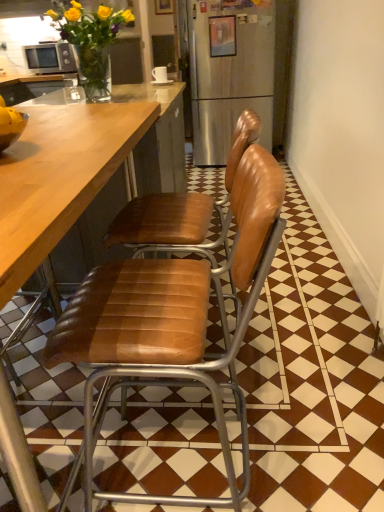
Question: Does white ceramic mug at upper center appear on the right side of translucent glass vase at upper left?

Choices:
 (A) no
 (B) yes

Answer: (B)

Question: From a real-world perspective, is white ceramic mug at upper center below translucent glass vase at upper left?

Choices:
 (A) yes
 (B) no

Answer: (A)

Question: Considering the relative sizes of white ceramic mug at upper center and translucent glass vase at upper left in the image provided, is white ceramic mug at upper center bigger than translucent glass vase at upper left?

Choices:
 (A) yes
 (B) no

Answer: (B)

Question: From the image's perspective, would you say white ceramic mug at upper center is shown under translucent glass vase at upper left?

Choices:
 (A) no
 (B) yes

Answer: (A)

Question: Is white ceramic mug at upper center further to the viewer compared to translucent glass vase at upper left?

Choices:
 (A) yes
 (B) no

Answer: (A)

Question: Are white ceramic mug at upper center and translucent glass vase at upper left located far from each other?

Choices:
 (A) yes
 (B) no

Answer: (B)

Question: Considering the relative positions of wooden picture frame at upper center, positioned as the 2th picture frame in top-to-bottom order, and leather at center, the second chair positioned from the back, in the image provided, is wooden picture frame at upper center, positioned as the 2th picture frame in top-to-bottom order, behind leather at center, the second chair positioned from the back,?

Choices:
 (A) yes
 (B) no

Answer: (A)

Question: From the image's perspective, is wooden picture frame at upper center, the 1th picture frame in the front-to-back sequence, above leather at center, the second chair positioned from the back?

Choices:
 (A) no
 (B) yes

Answer: (B)

Question: Is wooden picture frame at upper center, the 1th picture frame in the right-to-left sequence, oriented towards leather at center, which appears as the 1th chair when viewed from the front?

Choices:
 (A) yes
 (B) no

Answer: (A)

Question: From the image's perspective, is wooden picture frame at upper center, the 2th picture frame when ordered from back to front, under leather at center, the second chair positioned from the back?

Choices:
 (A) yes
 (B) no

Answer: (B)

Question: Is wooden picture frame at upper center, placed as the 2th picture frame when sorted from left to right, positioned with its back to leather at center, which appears as the 1th chair when viewed from the front?

Choices:
 (A) yes
 (B) no

Answer: (B)

Question: Is wooden picture frame at upper center, the 1th picture frame in the right-to-left sequence, to the right of leather at center, which appears as the 1th chair when viewed from the front, from the viewer's perspective?

Choices:
 (A) no
 (B) yes

Answer: (B)

Question: From a real-world perspective, is wooden picture frame at upper center, which is the 1th picture frame from back to front, on top of leather at center, which appears as the 1th chair when viewed from the front?

Choices:
 (A) yes
 (B) no

Answer: (A)